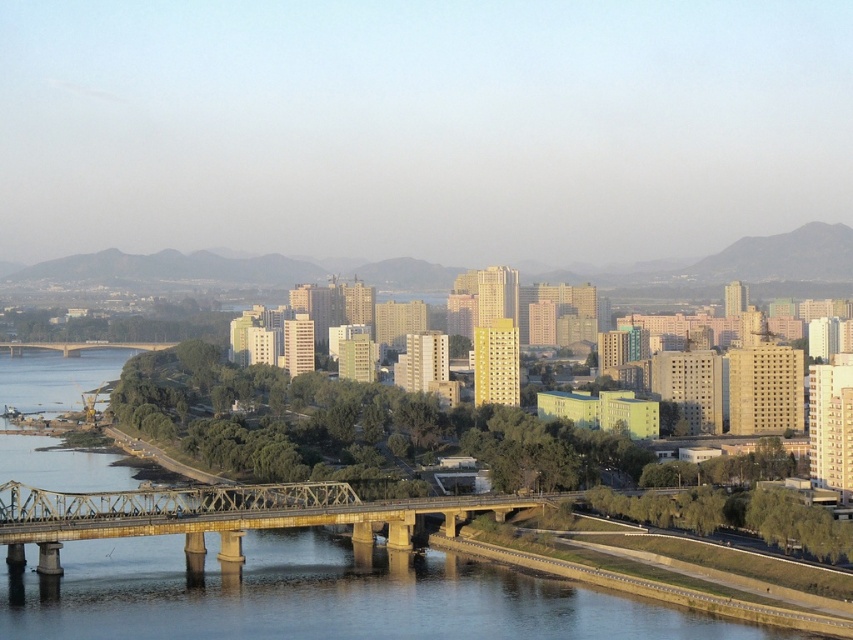
Question: Can you confirm if golden metallic bridge at center is thinner than brown metallic bridge at center?

Choices:
 (A) yes
 (B) no

Answer: (B)

Question: Can you confirm if golden metallic bridge at center is positioned to the right of brown metallic bridge at center?

Choices:
 (A) yes
 (B) no

Answer: (A)

Question: Which point is farther to the camera?

Choices:
 (A) brown metallic bridge at center
 (B) golden metallic bridge at center

Answer: (A)

Question: Does golden metallic bridge at center have a larger size compared to brown metallic bridge at center?

Choices:
 (A) yes
 (B) no

Answer: (A)

Question: Among these objects, which one is nearest to the camera?

Choices:
 (A) golden metallic bridge at center
 (B) brown metallic bridge at center

Answer: (A)